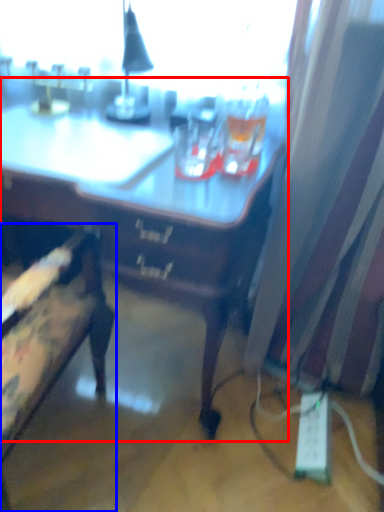
Question: Which object is further to the camera taking this photo, desk (highlighted by a red box) or chair (highlighted by a blue box)?

Choices:
 (A) desk
 (B) chair

Answer: (A)